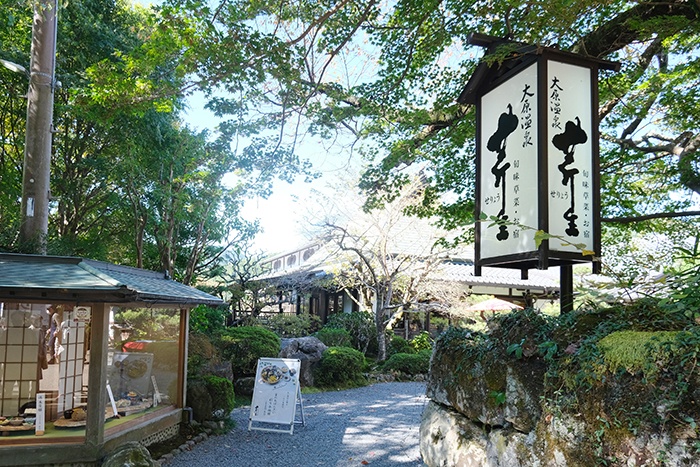
Image resolution: width=700 pixels, height=467 pixels. I want to click on small shop, so click(66, 368).